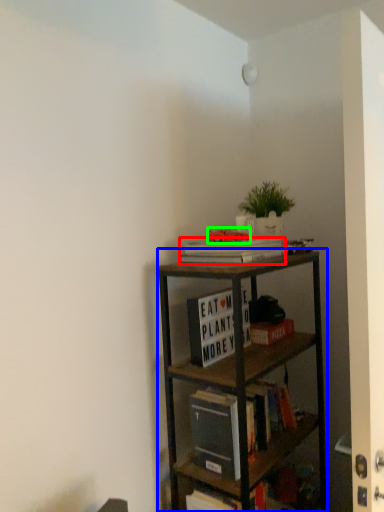
Question: Which object is positioned closest to book (highlighted by a red box)? Select from shelf (highlighted by a blue box) and toy (highlighted by a green box).

Choices:
 (A) shelf
 (B) toy

Answer: (B)